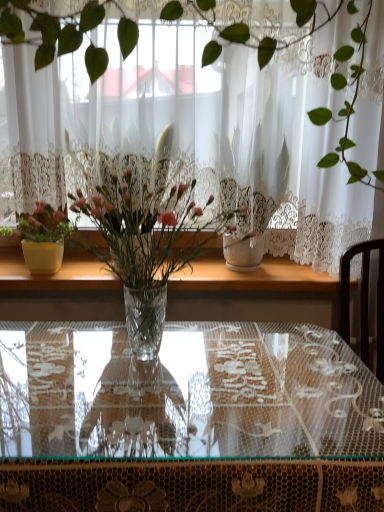
The height and width of the screenshot is (512, 384). In order to click on spots to the right of clear glass vase at center, positioned as the 2th houseplant in left-to-right order in this screenshot , I will do `click(302, 373)`.